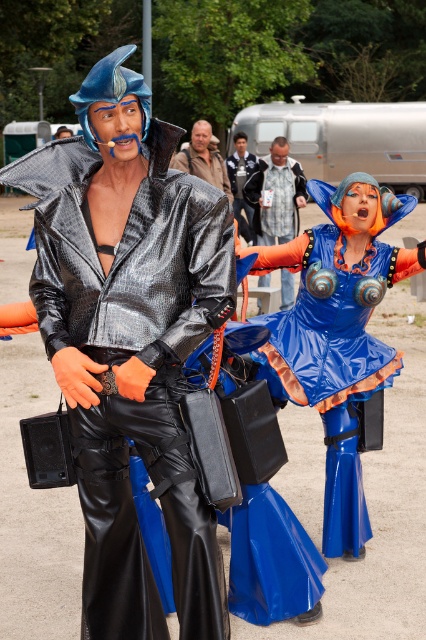
Question: Does orange fabric pants at center appear over shiny black jacket at center?

Choices:
 (A) no
 (B) yes

Answer: (A)

Question: Which of the following is the farthest from the observer?

Choices:
 (A) orange fabric pants at center
 (B) brown leather jacket at center
 (C) blue shiny dress at center
 (D) shiny metallic jacket at center

Answer: (A)

Question: Which object appears closest to the camera in this image?

Choices:
 (A) shiny black jacket at center
 (B) shiny metallic jacket at center
 (C) brown leather jacket at center
 (D) blue shiny dress at center

Answer: (B)

Question: Which point is closer to the camera?

Choices:
 (A) blue shiny dress at center
 (B) orange fabric pants at center

Answer: (A)

Question: Can you confirm if brown leather jacket at center is thinner than shiny black jacket at center?

Choices:
 (A) no
 (B) yes

Answer: (A)

Question: Does blue shiny dress at center appear on the right side of shiny black jacket at center?

Choices:
 (A) yes
 (B) no

Answer: (A)